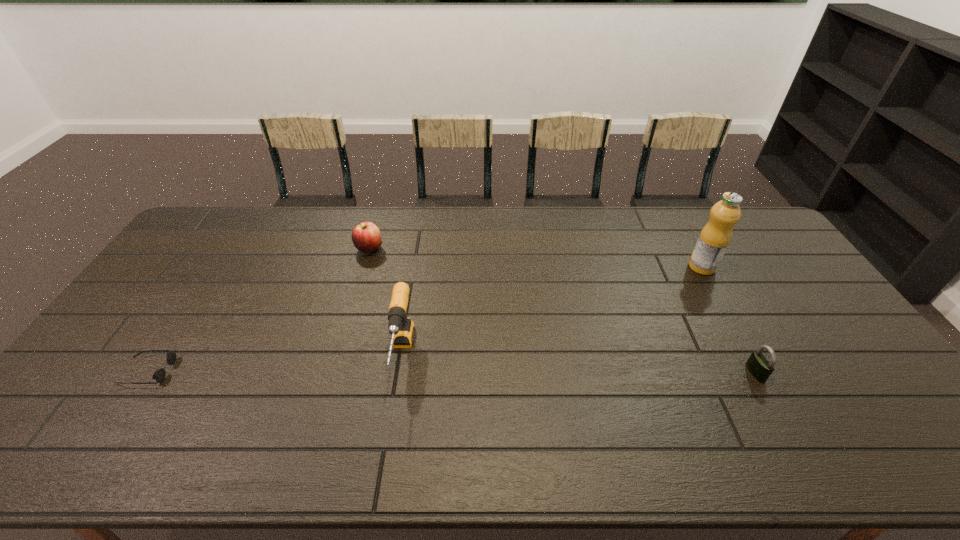
The height and width of the screenshot is (540, 960). What are the coordinates of `free point between the third object from left to right and the shortest object` in the screenshot? It's located at (275, 362).

At what (x,y) coordinates should I click in order to perform the action: click on empty space between the farthest object and the padlock. Please return your answer as a coordinate pair (x, y). Image resolution: width=960 pixels, height=540 pixels. Looking at the image, I should click on (x=563, y=310).

The width and height of the screenshot is (960, 540). What are the coordinates of `object that ranks as the closest to the second tallest object` in the screenshot? It's located at (366, 237).

Identify which object is located as the second nearest to the farthest object. Please provide its 2D coordinates. Your answer should be formatted as a tuple, i.e. [(x, y)], where the tuple contains the x and y coordinates of a point satisfying the conditions above.

[(159, 375)]

Find the location of a particular element. vacant space that satisfies the following two spatial constraints: 1. on the handle side of the fourth shortest object; 2. on the front-facing side of the shortest object is located at coordinates (399, 371).

Identify the location of vacant position in the image that satisfies the following two spatial constraints: 1. on the handle side of the third object from right to left; 2. on the front-facing side of the leftmost object. (399, 371).

The height and width of the screenshot is (540, 960). Find the location of `vacant space that satisfies the following two spatial constraints: 1. on the handle side of the drill; 2. on the front-facing side of the leftmost object`. vacant space that satisfies the following two spatial constraints: 1. on the handle side of the drill; 2. on the front-facing side of the leftmost object is located at coordinates (399, 371).